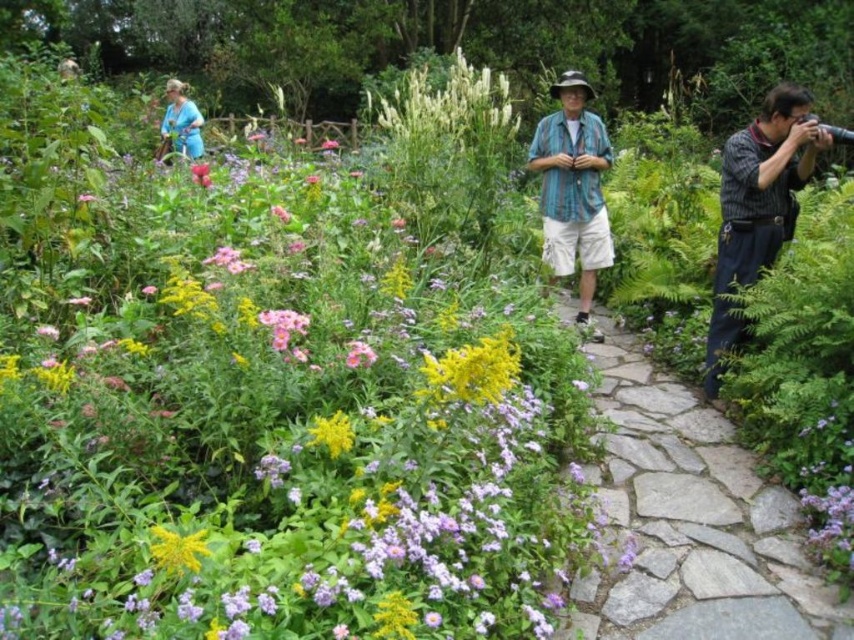
Question: Can you confirm if gray stone path at center-right is positioned below white fluffy plant at center?

Choices:
 (A) yes
 (B) no

Answer: (A)

Question: Can you confirm if striped shirt at right is smaller than blue plaid shirt at center?

Choices:
 (A) no
 (B) yes

Answer: (B)

Question: Which object is farther from the camera taking this photo?

Choices:
 (A) white fluffy plant at center
 (B) striped shirt at right
 (C) yellow matte flower at center-left
 (D) gray stone path at center-right

Answer: (A)

Question: Among these objects, which one is nearest to the camera?

Choices:
 (A) blue plaid shirt at center
 (B) striped shirt at right

Answer: (B)

Question: Does gray stone path at center-right lie behind white fluffy plant at center?

Choices:
 (A) yes
 (B) no

Answer: (B)

Question: Which of these objects is positioned farthest from the striped shirt at right?

Choices:
 (A) yellow matte flower at center-left
 (B) gray stone path at center-right

Answer: (A)